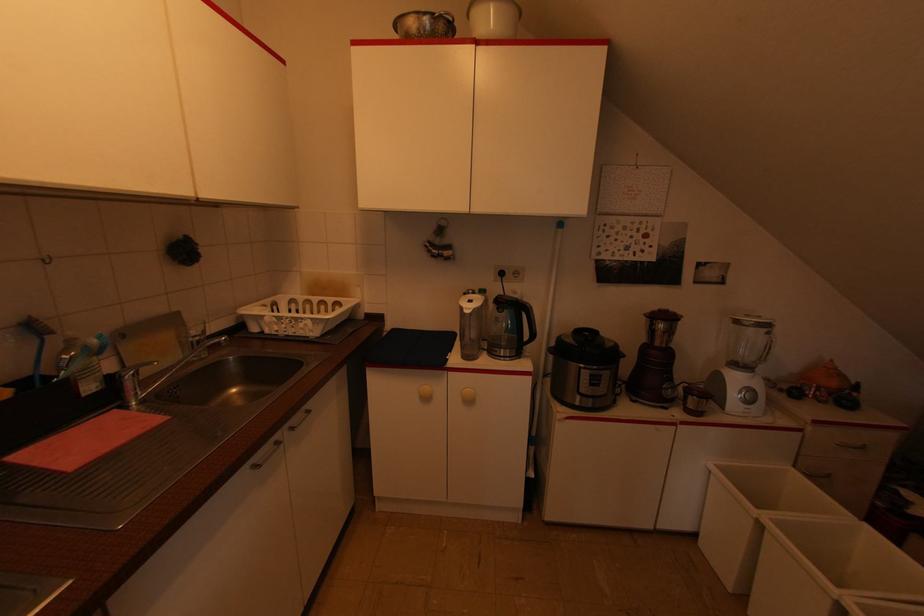
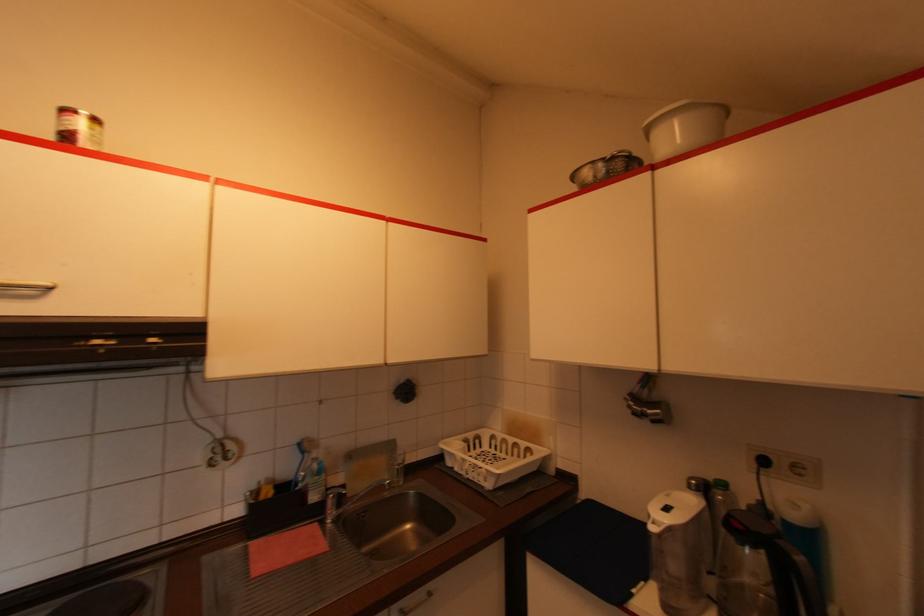
Find the pixel in the second image that matches [307,411] in the first image.

(431, 594)